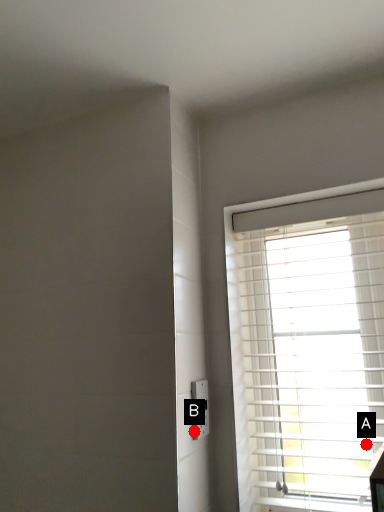
Question: Two points are circled on the image, labeled by A and B beside each circle. Among these points, which one is nearest to the camera?

Choices:
 (A) A is closer
 (B) B is closer

Answer: (B)